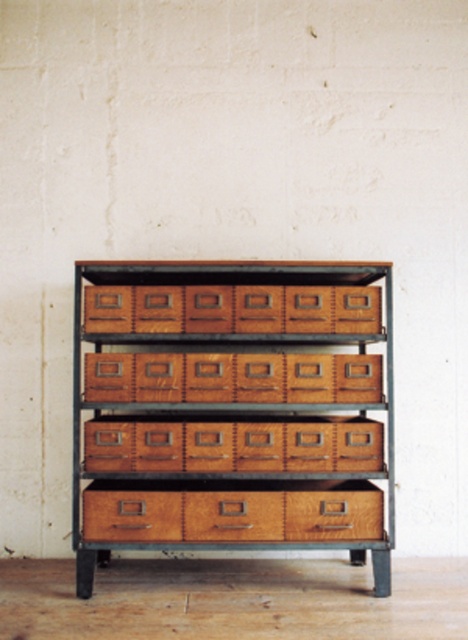
This screenshot has width=468, height=640. Describe the element at coordinates (232, 512) in the screenshot. I see `natural wood drawer at lower center` at that location.

Can you confirm if natural wood drawer at lower center is positioned below wooden grain drawer at center?

No.

This screenshot has width=468, height=640. Describe the element at coordinates (232, 512) in the screenshot. I see `natural wood drawer at lower center` at that location.

At what (x,y) coordinates should I click in order to perform the action: click on natural wood drawer at lower center. Please return your answer as a coordinate pair (x, y). Image resolution: width=468 pixels, height=640 pixels. Looking at the image, I should click on (232, 512).

Which is more to the left, wooden crate at center or wooden grain drawer at center?

Positioned to the left is wooden crate at center.

Is wooden crate at center shorter than wooden grain drawer at center?

Yes.

Is point (269, 291) closer to camera compared to point (308, 520)?

That is False.

The height and width of the screenshot is (640, 468). I want to click on wooden crate at center, so click(233, 308).

Between natural wood drawer at lower center and wooden drawer at center, which one is positioned higher?

wooden drawer at center is above.

This screenshot has width=468, height=640. Find the location of `natural wood drawer at lower center`. natural wood drawer at lower center is located at coordinates (232, 512).

Does point (140, 520) lie behind point (335, 420)?

No, it is in front of (335, 420).

Locate an element on the screen. The image size is (468, 640). natural wood drawer at lower center is located at coordinates (232, 512).